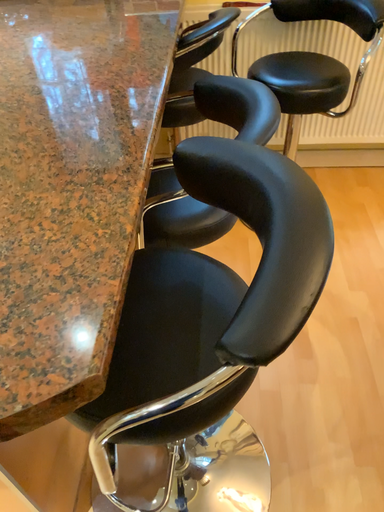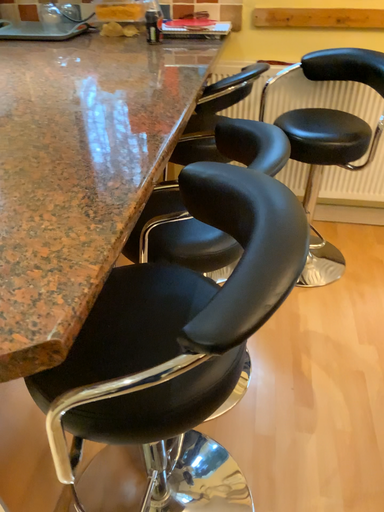
Question: How did the camera likely rotate when shooting the video?

Choices:
 (A) rotated downward
 (B) rotated upward

Answer: (B)